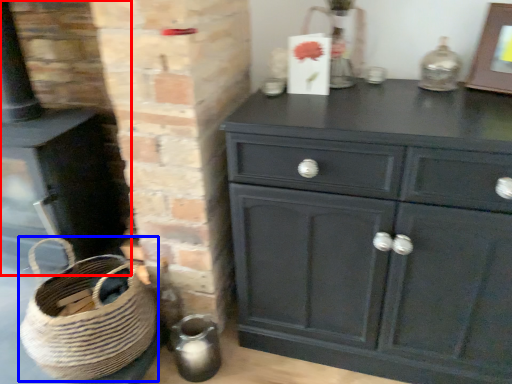
Question: Which object appears closest to the camera in this image, fireplace (highlighted by a red box) or basket (highlighted by a blue box)?

Choices:
 (A) fireplace
 (B) basket

Answer: (B)